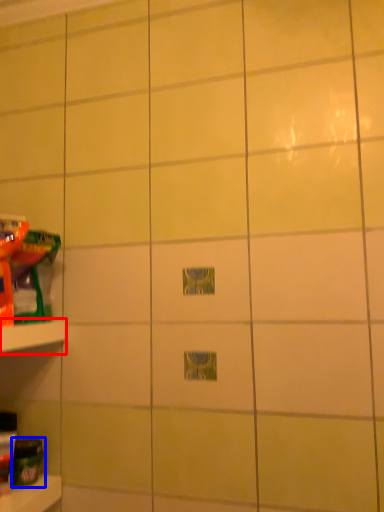
Question: Which object is further to the camera taking this photo, shelf (highlighted by a red box) or toy (highlighted by a blue box)?

Choices:
 (A) shelf
 (B) toy

Answer: (B)